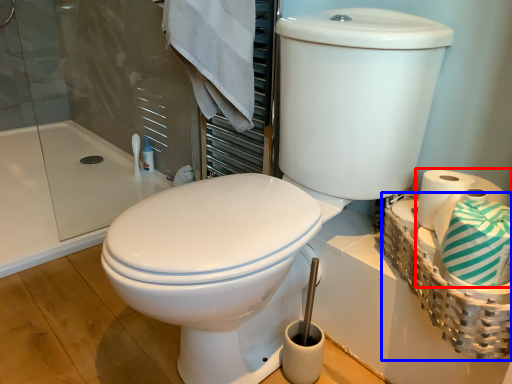
Question: Which object is closer to the camera taking this photo, toilet paper (highlighted by a red box) or basket (highlighted by a blue box)?

Choices:
 (A) toilet paper
 (B) basket

Answer: (A)